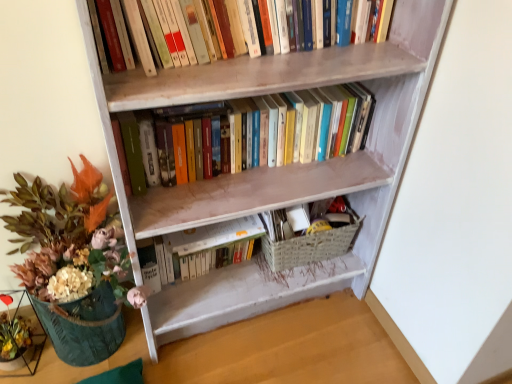
Identify the location of vacant space that is in between green textured vase at lower left and wooden bookcase at center. (237, 345).